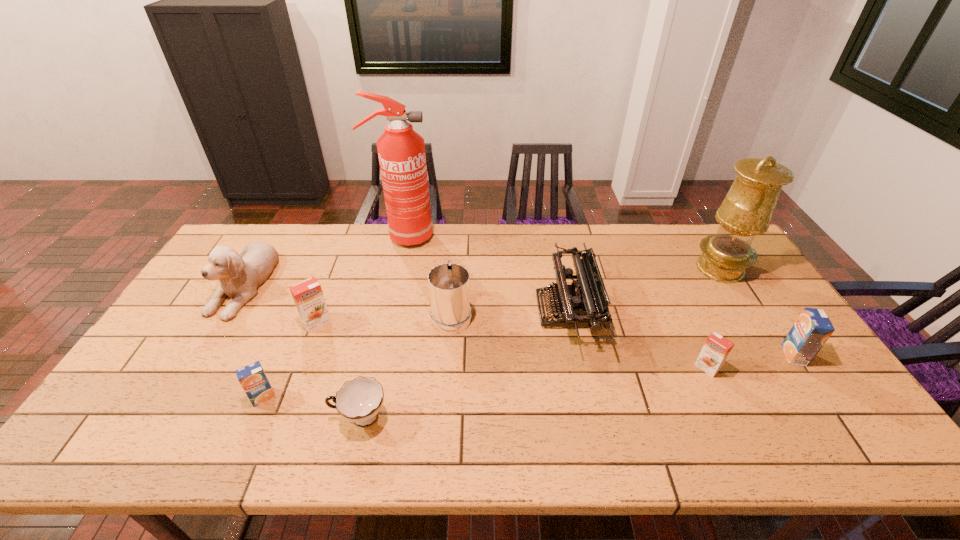
Locate an element on the screen. vacant position located on the front of the nearest orange_juice is located at coordinates (240, 450).

Where is `vacant region located 0.220m on the side of the cup with the handle`? vacant region located 0.220m on the side of the cup with the handle is located at coordinates (239, 417).

You are a GUI agent. You are given a task and a screenshot of the screen. Output one action in this format:
    pyautogui.click(x=<x>, y=<y>)
    Task: Click on the vacant space situated on the side of the cup with the handle
    
    Given the screenshot: What is the action you would take?
    pyautogui.click(x=202, y=417)

You are a GUI agent. You are given a task and a screenshot of the screen. Output one action in this format:
    pyautogui.click(x=<x>, y=<y>)
    Task: Click on the vacant region located 0.360m on the side of the cup with the handle
    
    Given the screenshot: What is the action you would take?
    pyautogui.click(x=180, y=417)

Identify the location of fire extinguisher positioned at the far edge. (401, 151).

Find the location of a particular element. oil lamp present at the far edge is located at coordinates (746, 211).

At what (x,y) coordinates should I click in order to perform the action: click on puppy that is at the far edge. Please return your answer as a coordinate pair (x, y). This screenshot has height=540, width=960. Looking at the image, I should click on (240, 275).

I want to click on object that is at the near edge, so click(359, 401).

The height and width of the screenshot is (540, 960). Identify the location of object present at the left edge. (240, 275).

Where is `oil lamp present at the right edge`? oil lamp present at the right edge is located at coordinates (746, 211).